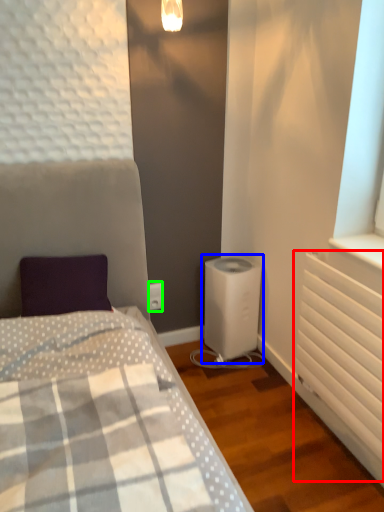
Question: Considering the real-world distances, which object is farthest from radiator (highlighted by a red box)? water heater (highlighted by a blue box) or electric outlet (highlighted by a green box)?

Choices:
 (A) water heater
 (B) electric outlet

Answer: (B)